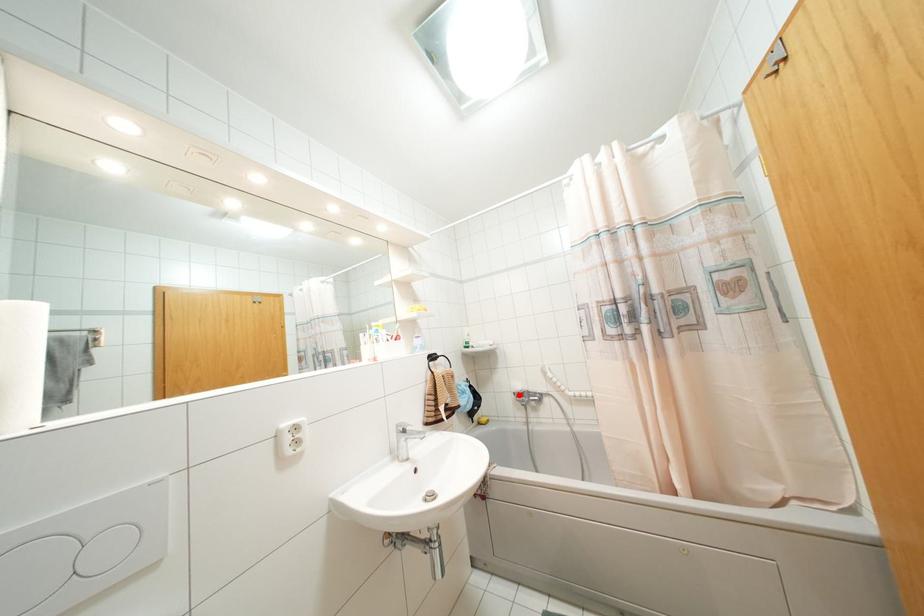
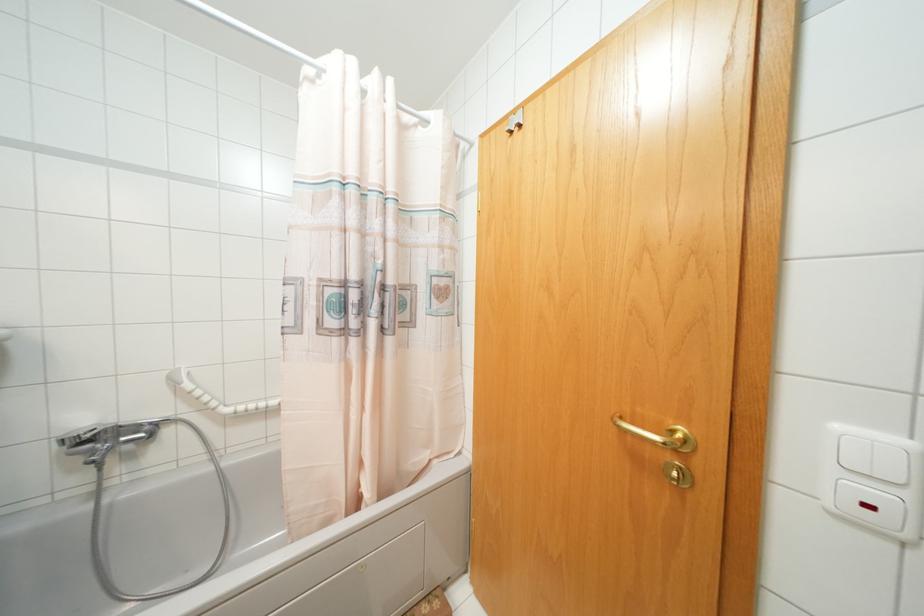
Find the pixel in the second image that matches the highlighted location in the first image.

(84, 440)